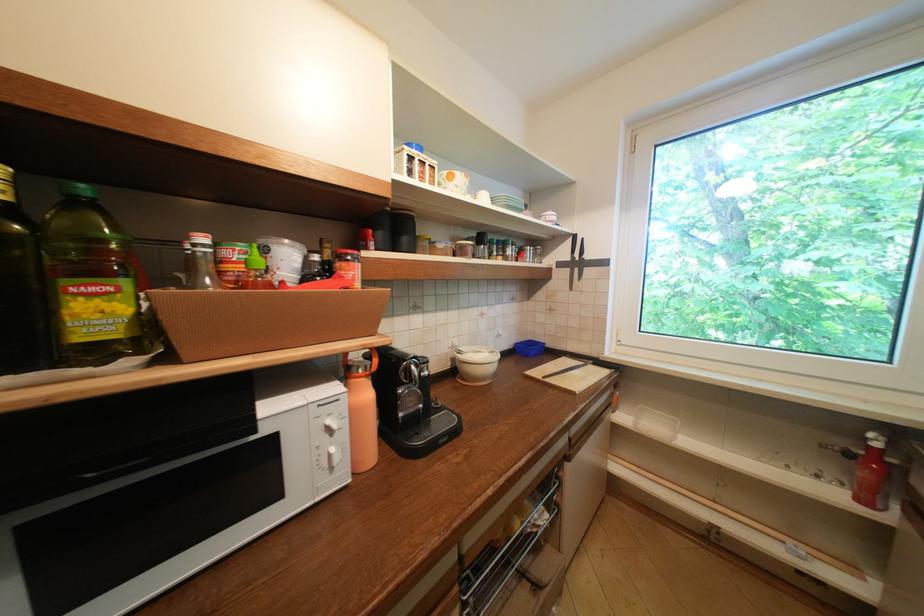
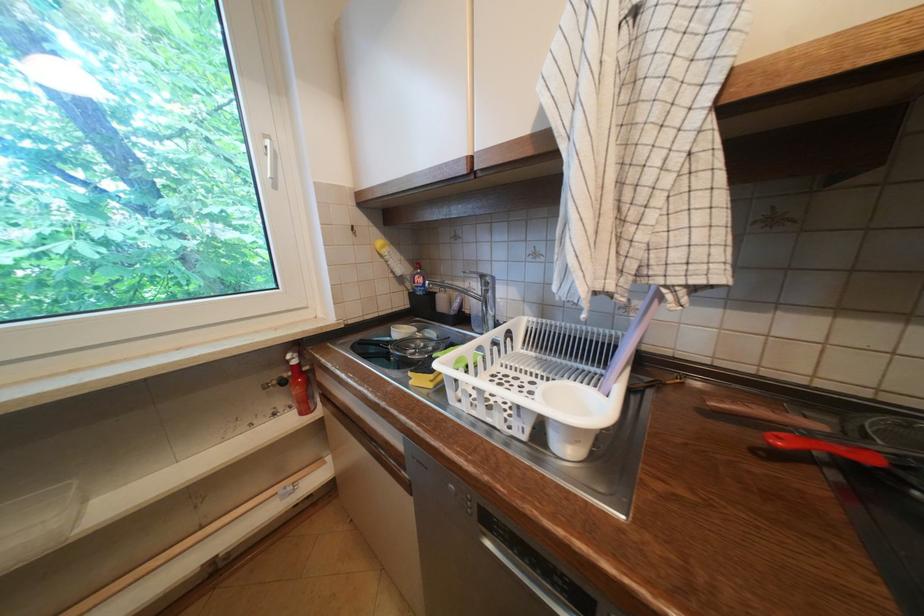
Find the pixel in the second image that matches (874,440) in the first image.

(296, 362)